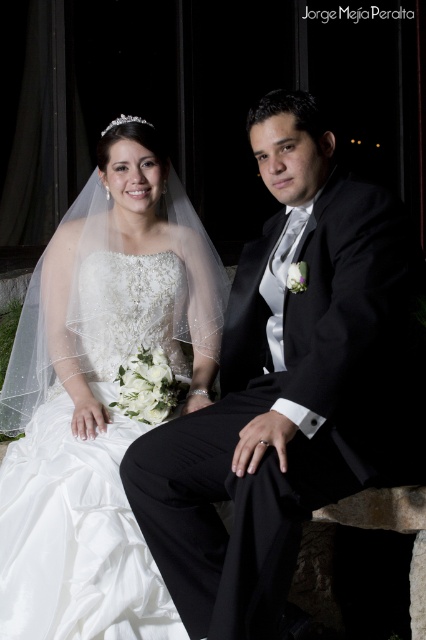
Question: Can you confirm if black satin suit at center is positioned to the left of white satin dress at center?

Choices:
 (A) no
 (B) yes

Answer: (A)

Question: Among these points, which one is nearest to the camera?

Choices:
 (A) (218, 282)
 (B) (368, 221)

Answer: (B)

Question: Among these objects, which one is nearest to the camera?

Choices:
 (A) white satin dress at center
 (B) black satin suit at center

Answer: (B)

Question: Is black satin suit at center closer to camera compared to white satin dress at center?

Choices:
 (A) no
 (B) yes

Answer: (B)

Question: Can you confirm if black satin suit at center is positioned to the left of white satin dress at center?

Choices:
 (A) no
 (B) yes

Answer: (A)